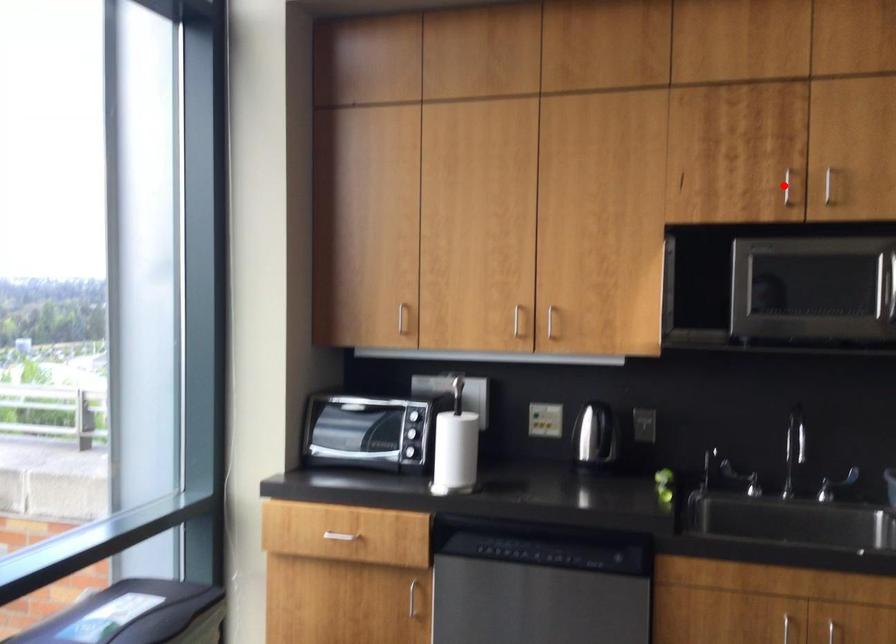
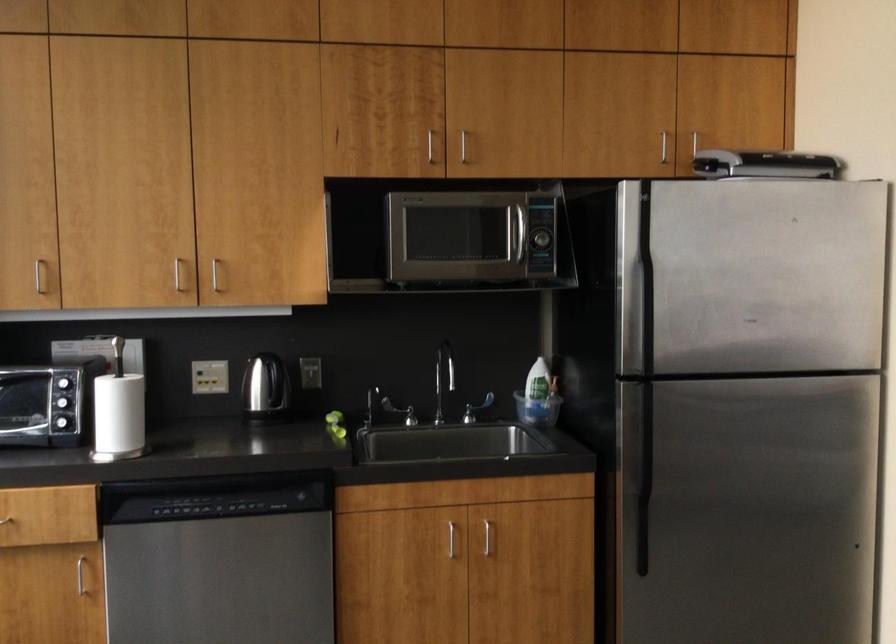
In the second image, find the point that corresponds to the highlighted location in the first image.

(431, 147)